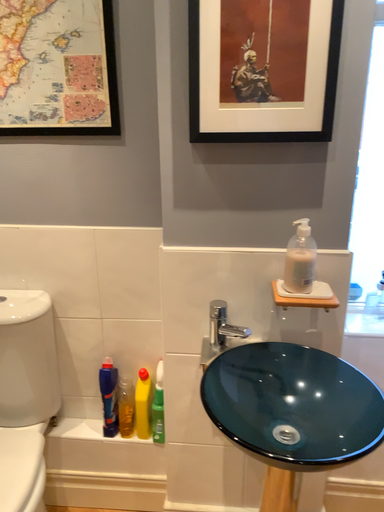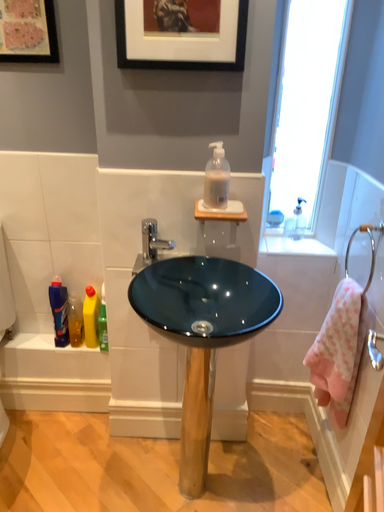
Question: Which way did the camera rotate in the video?

Choices:
 (A) rotated downward
 (B) rotated upward

Answer: (A)